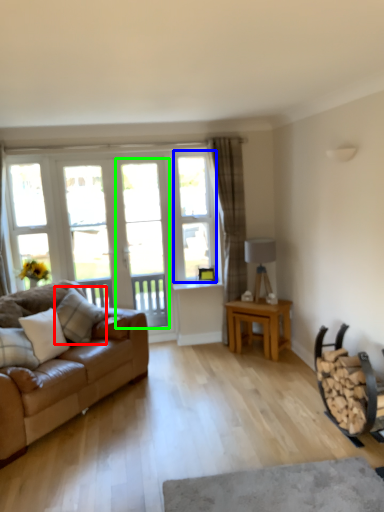
Question: Which is farther away from pillow (highlighted by a red box)? window (highlighted by a blue box) or screen door (highlighted by a green box)?

Choices:
 (A) window
 (B) screen door

Answer: (A)